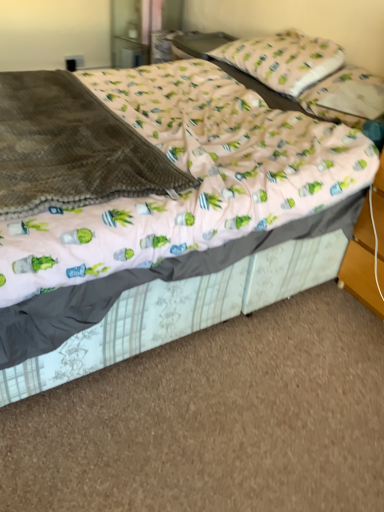
I want to click on pink fabric pillow at upper center, the 2th pillow from the bottom, so click(283, 60).

Identify the location of pink fabric pillow at upper center, which is counted as the first pillow, starting from the top. (283, 60).

From the image's perspective, is brown fleece blanket at left on top of pink fabric pillow at upper right, the 2th pillow when ordered from top to bottom?

No.

Measure the distance from brown fleece blanket at left to pink fabric pillow at upper right, the 1th pillow positioned from the bottom.

1.05 meters.

Is brown fleece blanket at left taller or shorter than pink fabric pillow at upper right, the 1th pillow positioned from the bottom?

Clearly, brown fleece blanket at left is taller compared to pink fabric pillow at upper right, the 1th pillow positioned from the bottom.

From a real-world perspective, which object stands above the other?

pink fabric pillow at upper right, the 1th pillow positioned from the bottom, is physically above.

From a real-world perspective, is pink fabric pillow at upper center, which is counted as the first pillow, starting from the top, on pink fabric bed at center?

Correct, in the physical world, pink fabric pillow at upper center, which is counted as the first pillow, starting from the top, is higher than pink fabric bed at center.

Considering the sizes of objects pink fabric pillow at upper center, the 2th pillow from the bottom, and pink fabric bed at center in the image provided, who is taller, pink fabric pillow at upper center, the 2th pillow from the bottom, or pink fabric bed at center?

pink fabric bed at center.

Considering the sizes of pink fabric pillow at upper center, which is counted as the first pillow, starting from the top, and pink fabric bed at center in the image, is pink fabric pillow at upper center, which is counted as the first pillow, starting from the top, wider or thinner than pink fabric bed at center?

pink fabric pillow at upper center, which is counted as the first pillow, starting from the top, is thinner than pink fabric bed at center.

Is pink fabric pillow at upper center, which is counted as the first pillow, starting from the top, inside or outside of pink fabric bed at center?

pink fabric pillow at upper center, which is counted as the first pillow, starting from the top, is located inside pink fabric bed at center.

How much distance is there between pink fabric pillow at upper center, the 2th pillow from the bottom, and brown fleece blanket at left?

pink fabric pillow at upper center, the 2th pillow from the bottom, and brown fleece blanket at left are 1.06 meters apart.

Considering the relative positions of pink fabric pillow at upper center, which is counted as the first pillow, starting from the top, and brown fleece blanket at left in the image provided, is pink fabric pillow at upper center, which is counted as the first pillow, starting from the top, to the right of brown fleece blanket at left from the viewer's perspective?

Yes, pink fabric pillow at upper center, which is counted as the first pillow, starting from the top, is to the right of brown fleece blanket at left.

Is pink fabric pillow at upper center, which is counted as the first pillow, starting from the top, bigger or smaller than brown fleece blanket at left?

pink fabric pillow at upper center, which is counted as the first pillow, starting from the top, is smaller than brown fleece blanket at left.

Does pink fabric pillow at upper center, the 2th pillow from the bottom, have a greater height compared to brown fleece blanket at left?

Correct, pink fabric pillow at upper center, the 2th pillow from the bottom, is much taller as brown fleece blanket at left.

Can you confirm if brown fleece blanket at left is wider than pink fabric bed at center?

Incorrect, the width of brown fleece blanket at left does not surpass that of pink fabric bed at center.

From a real-world perspective, is brown fleece blanket at left on pink fabric bed at center?

Yes, from a real-world perspective, brown fleece blanket at left is above pink fabric bed at center.

Which object is more forward, brown fleece blanket at left or pink fabric bed at center?

Positioned in front is pink fabric bed at center.

Is pink fabric pillow at upper right, the 1th pillow positioned from the bottom, aimed at brown fleece blanket at left?

Yes, pink fabric pillow at upper right, the 1th pillow positioned from the bottom, is aimed at brown fleece blanket at left.

Which is closer to the camera, (321, 95) or (23, 125)?

Clearly, point (321, 95) is more distant from the camera than point (23, 125).

Between pink fabric pillow at upper right, the 1th pillow positioned from the bottom, and brown fleece blanket at left, which one appears on the left side from the viewer's perspective?

brown fleece blanket at left is more to the left.

Which of these two, pink fabric pillow at upper right, the 1th pillow positioned from the bottom, or brown fleece blanket at left, stands shorter?

pink fabric pillow at upper right, the 1th pillow positioned from the bottom.

Is point (342, 77) positioned before point (285, 68)?

Yes, point (342, 77) is closer to viewer.

From a real-world perspective, is pink fabric pillow at upper right, the 2th pillow when ordered from top to bottom, positioned above or below pink fabric pillow at upper center, which is counted as the first pillow, starting from the top?

pink fabric pillow at upper right, the 2th pillow when ordered from top to bottom, is below pink fabric pillow at upper center, which is counted as the first pillow, starting from the top.

You are a GUI agent. You are given a task and a screenshot of the screen. Output one action in this format:
    pyautogui.click(x=<x>, y=<y>)
    Task: Click on the pillow below the pink fabric pillow at upper center, the 2th pillow from the bottom (from the image's perspective)
    
    Given the screenshot: What is the action you would take?
    pyautogui.click(x=347, y=98)

Which object is thinner, pink fabric pillow at upper right, the 1th pillow positioned from the bottom, or pink fabric pillow at upper center, the 2th pillow from the bottom?

Thinner between the two is pink fabric pillow at upper right, the 1th pillow positioned from the bottom.

Based on the photo, which object is further away from the camera taking this photo, pink fabric bed at center or pink fabric pillow at upper center, the 2th pillow from the bottom?

pink fabric pillow at upper center, the 2th pillow from the bottom, is more distant.

From a real-world perspective, which object stands above the other?

In real-world perspective, pink fabric pillow at upper center, which is counted as the first pillow, starting from the top, is above.

Between pink fabric bed at center and pink fabric pillow at upper center, which is counted as the first pillow, starting from the top, which one has smaller size?

pink fabric pillow at upper center, which is counted as the first pillow, starting from the top, is smaller.

Image resolution: width=384 pixels, height=512 pixels. Identify the location of blanket in front of the pink fabric pillow at upper right, the 1th pillow positioned from the bottom. (71, 148).

This screenshot has width=384, height=512. In order to click on bed that is on the left side of pink fabric pillow at upper center, which is counted as the first pillow, starting from the top in this screenshot , I will do pyautogui.click(x=179, y=227).

Looking at this image, from the image, which object appears to be farther from pink fabric pillow at upper right, the 1th pillow positioned from the bottom, pink fabric bed at center or pink fabric pillow at upper center, which is counted as the first pillow, starting from the top?

pink fabric bed at center lies further to pink fabric pillow at upper right, the 1th pillow positioned from the bottom, than the other object.

Based on their spatial positions, is pink fabric bed at center or pink fabric pillow at upper right, the 2th pillow when ordered from top to bottom, closer to pink fabric pillow at upper center, which is counted as the first pillow, starting from the top?

pink fabric pillow at upper right, the 2th pillow when ordered from top to bottom, lies closer to pink fabric pillow at upper center, which is counted as the first pillow, starting from the top, than the other object.

Considering their positions, is pink fabric pillow at upper right, the 2th pillow when ordered from top to bottom, positioned closer to pink fabric bed at center than brown fleece blanket at left?

brown fleece blanket at left is closer to pink fabric bed at center.

Estimate the real-world distances between objects in this image. Which object is further from brown fleece blanket at left, pink fabric pillow at upper center, which is counted as the first pillow, starting from the top, or pink fabric pillow at upper right, the 2th pillow when ordered from top to bottom?

pink fabric pillow at upper center, which is counted as the first pillow, starting from the top, is further to brown fleece blanket at left.

In the scene shown: When comparing their distances from pink fabric pillow at upper right, the 1th pillow positioned from the bottom, does pink fabric pillow at upper center, which is counted as the first pillow, starting from the top, or pink fabric bed at center seem closer?

pink fabric pillow at upper center, which is counted as the first pillow, starting from the top, is closer to pink fabric pillow at upper right, the 1th pillow positioned from the bottom.

Considering their positions, is pink fabric pillow at upper center, the 2th pillow from the bottom, positioned closer to brown fleece blanket at left than pink fabric bed at center?

pink fabric bed at center is closer to brown fleece blanket at left.

Which object lies further to the anchor point pink fabric pillow at upper center, the 2th pillow from the bottom, brown fleece blanket at left or pink fabric bed at center?

brown fleece blanket at left lies further to pink fabric pillow at upper center, the 2th pillow from the bottom, than the other object.

From the image, which object appears to be nearer to pink fabric pillow at upper center, the 2th pillow from the bottom, pink fabric bed at center or brown fleece blanket at left?

Based on the image, pink fabric bed at center appears to be nearer to pink fabric pillow at upper center, the 2th pillow from the bottom.

Image resolution: width=384 pixels, height=512 pixels. I want to click on pillow positioned between pink fabric bed at center and pink fabric pillow at upper center, which is counted as the first pillow, starting from the top, from near to far, so click(x=347, y=98).

Find the location of a particular element. bed situated between brown fleece blanket at left and pink fabric pillow at upper right, the 1th pillow positioned from the bottom, from left to right is located at coordinates (179, 227).

Image resolution: width=384 pixels, height=512 pixels. Find the location of `pillow located between brown fleece blanket at left and pink fabric pillow at upper right, the 2th pillow when ordered from top to bottom, in the left-right direction`. pillow located between brown fleece blanket at left and pink fabric pillow at upper right, the 2th pillow when ordered from top to bottom, in the left-right direction is located at coordinates (283, 60).

Find the location of a particular element. blanket between pink fabric bed at center and pink fabric pillow at upper center, the 2th pillow from the bottom, from front to back is located at coordinates (71, 148).